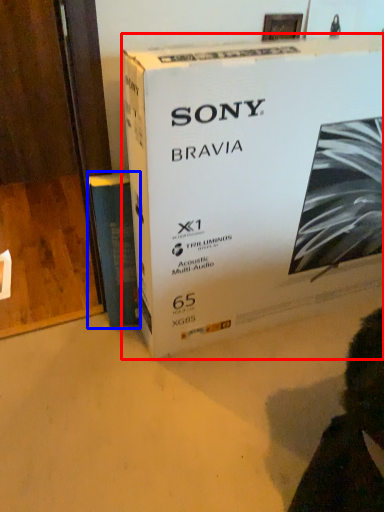
Question: Which point is closer to the camera, box (highlighted by a red box) or paperback book (highlighted by a blue box)?

Choices:
 (A) box
 (B) paperback book

Answer: (A)